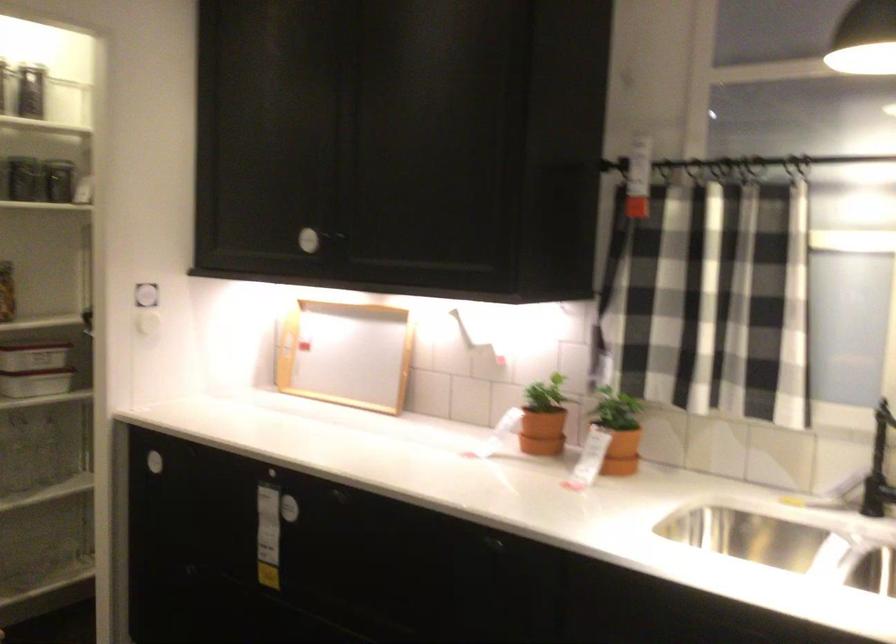
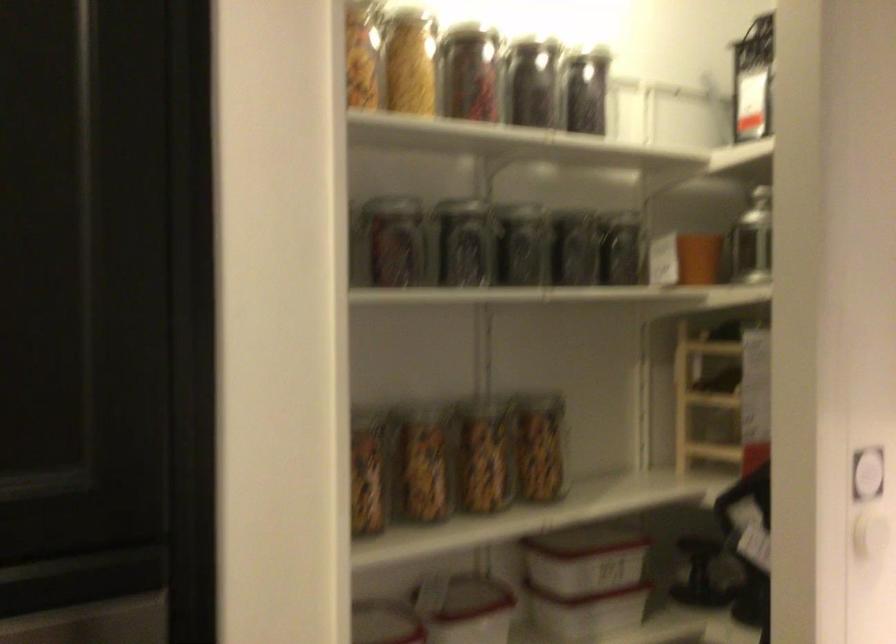
The images are taken continuously from a first-person perspective. In which direction are you moving?

The cameraman moved toward left, forward.